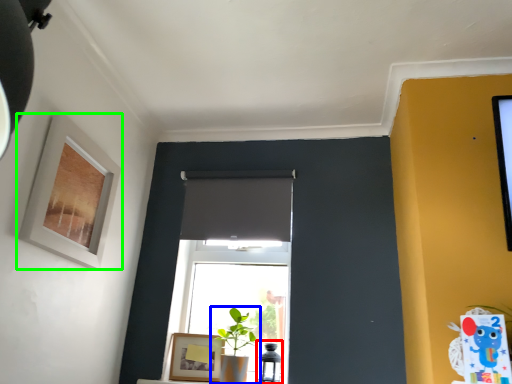
Question: Estimate the real-world distances between objects in this image. Which object is farther from table lamp (highlighted by a red box), houseplant (highlighted by a blue box) or picture frame (highlighted by a green box)?

Choices:
 (A) houseplant
 (B) picture frame

Answer: (B)